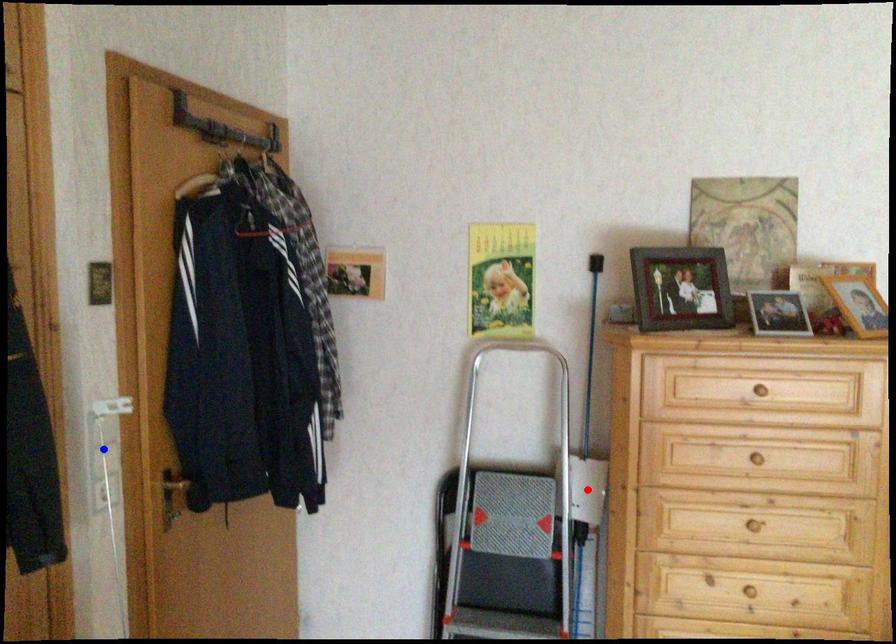
Question: Two points are marked on the image. Which point is closer to the camera?

Choices:
 (A) Blue point is closer.
 (B) Red point is closer.

Answer: (A)